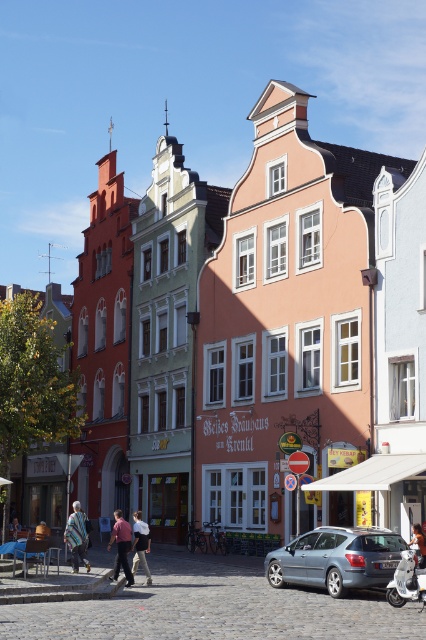
You are standing at a point in the street scene and want to take a photo of both the reddish building with a small pointed gable and the green building with a curved roofline. Given the two points marked as point 1 at coordinates (143, 548) and point 2 at coordinates (16, 532), which point should you choose to ensure both buildings are fully visible in your frame without any obstruction?

Point 1 at coordinates (143, 548) is in front of point 2 at coordinates (16, 532). Therefore, choosing point 2 at coordinates (16, 532) would provide a better vantage point to capture both the reddish building with a small pointed gable and the green building with a curved roofline without obstruction, as it is positioned behind point 1 and offers a clearer view.

You are a delivery person with a package that requires a 10 meter clearance to safely maneuver your vehicle. You are currently positioned near the metallic silver hatchback at lower center and need to reach the white cotton shirt at center. Can you safely navigate your vehicle through the space between them without any obstructions?

The distance between the metallic silver hatchback at lower center and the white cotton shirt at center is 8.14 meters, which is less than the required 10 meter clearance. Therefore, you cannot safely navigate your vehicle through the space between them without risking obstructions.

You are a tourist standing on the street looking at the matte pink building at center and the striped woolen scarf at lower left. Which object is taller?

The matte pink building at center is much taller than the striped woolen scarf at lower left.